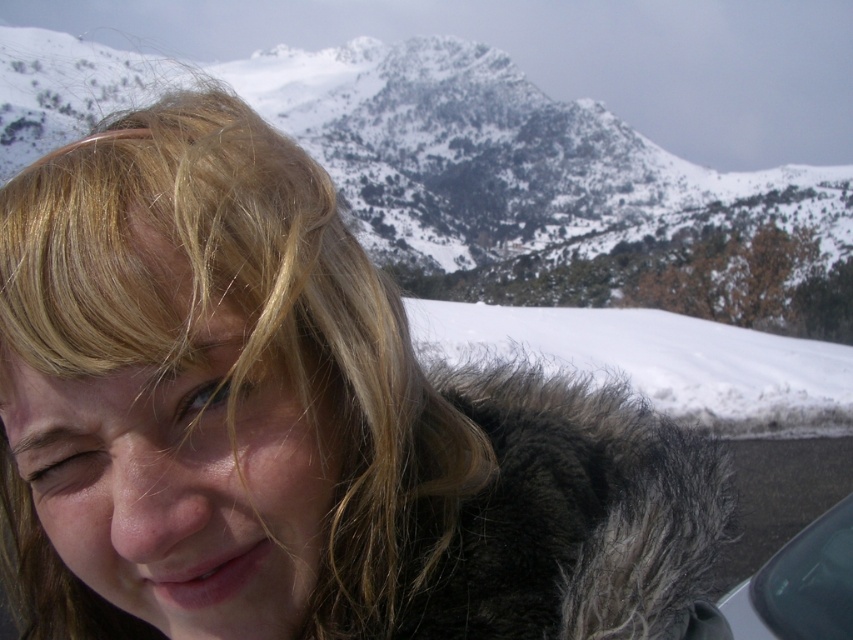
What are the coordinates of the snowy rocky mountain at upper center in the image?

The coordinates of the snowy rocky mountain at upper center are at point (548, 189).

Consider the image. You are standing at the viewpoint in the image and want to reach the point marked as point (627,276). Given that you can walk at a speed of 1.5 meters per second, how many seconds will it take you to reach that point?

The distance between the viewer and point (627,276) is 138.65 meters. At a walking speed of 1.5 meters per second, it would take approximately 92.43 seconds to reach the point. This is calculated by dividing the distance by the speed.